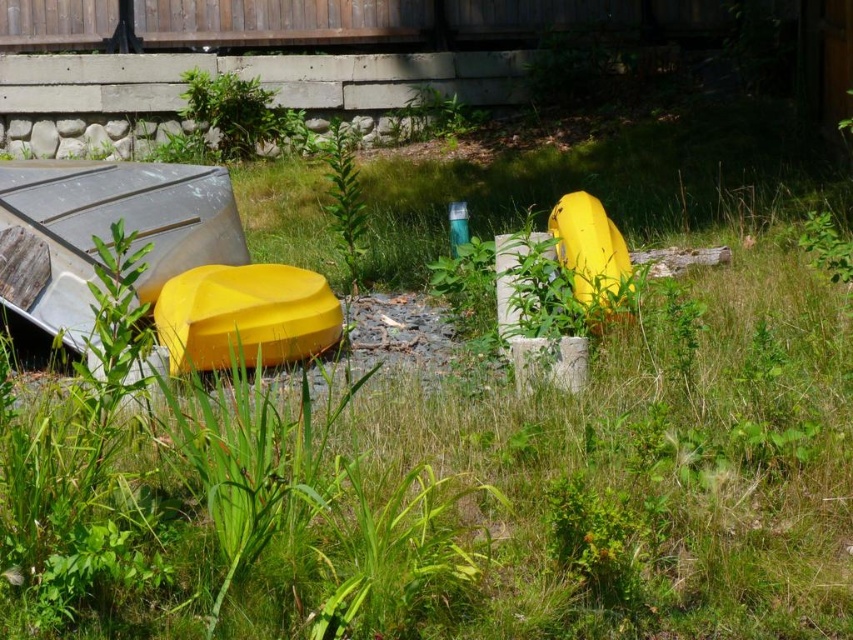
Question: Can you confirm if matte yellow kayak at left is bigger than yellow matte boat at center?

Choices:
 (A) no
 (B) yes

Answer: (B)

Question: Can you confirm if matte yellow kayak at left is positioned to the left of yellow matte boat at center?

Choices:
 (A) yes
 (B) no

Answer: (A)

Question: Which object is closer to the camera taking this photo?

Choices:
 (A) yellow matte boat at center
 (B) matte yellow kayak at left

Answer: (A)

Question: Which point appears farthest from the camera in this image?

Choices:
 (A) (47, 260)
 (B) (310, 348)

Answer: (B)

Question: Is matte yellow kayak at left to the right of yellow matte boat at center from the viewer's perspective?

Choices:
 (A) no
 (B) yes

Answer: (A)